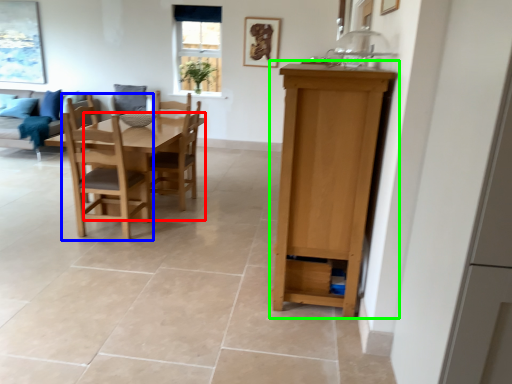
Question: Based on their relative distances, which object is farther from table (highlighted by a red box)? Choose from chair (highlighted by a blue box) and cabinetry (highlighted by a green box).

Choices:
 (A) chair
 (B) cabinetry

Answer: (B)